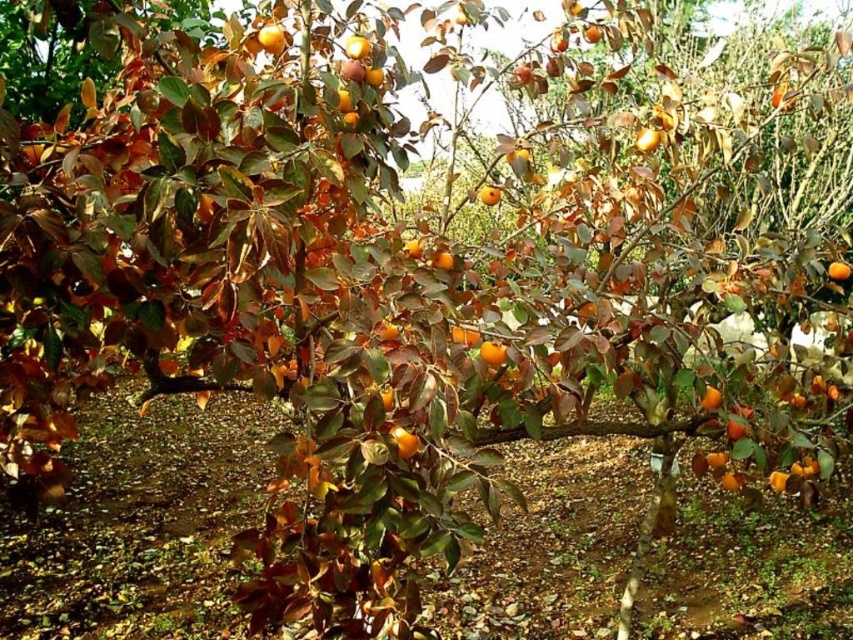
Is orange matte/orange at center smaller than orange matte fruit at center?

Yes, orange matte/orange at center is smaller than orange matte fruit at center.

Who is higher up, orange matte/orange at center or orange matte fruit at center?

orange matte fruit at center is higher up.

Identify the location of orange matte/orange at center. The height and width of the screenshot is (640, 853). (711, 397).

Does orange matte/orange at upper center lie in front of orange matte/orange at lower right?

Yes, it is.

Who is shorter, orange matte/orange at upper center or orange matte/orange at lower right?

orange matte/orange at upper center is shorter.

Locate an element on the screen. The image size is (853, 640). orange matte/orange at upper center is located at coordinates pyautogui.click(x=647, y=140).

The height and width of the screenshot is (640, 853). What are the coordinates of `orange matte/orange at upper center` in the screenshot? It's located at click(647, 140).

Between orange matte fruit at center and orange matte/orange at lower right, which one is positioned lower?

orange matte/orange at lower right is lower down.

Locate an element on the screen. This screenshot has width=853, height=640. orange matte fruit at center is located at coordinates (489, 195).